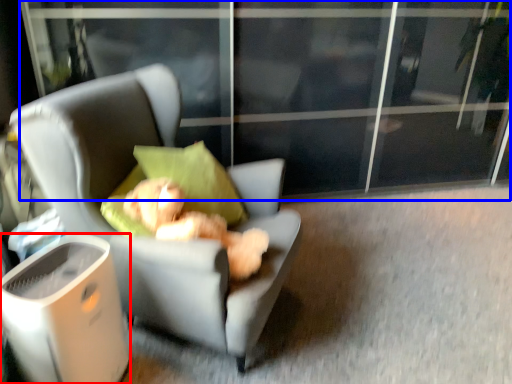
Question: Which object is further to the camera taking this photo, trash bin/can (highlighted by a red box) or screen door (highlighted by a blue box)?

Choices:
 (A) trash bin/can
 (B) screen door

Answer: (B)